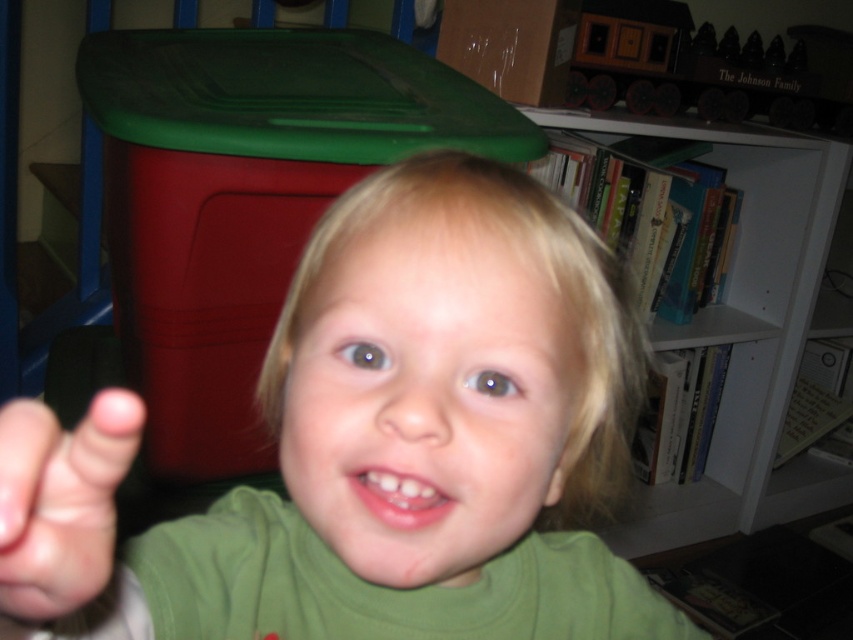
You are a photographer trying to capture a photo of the child and the white matte bookshelf at upper right. The green matte shirt at center is blocking part of the bookshelf. Can you adjust your position to the left or right to get a clear view of both the child and the bookshelf without the shirt blocking it?

The green matte shirt at center is positioned on the left side of the white matte bookshelf at upper right. To avoid blocking, move to the right side so that the shirt moves out of the way, allowing both the child and the bookshelf to be visible.

You are standing in the room where the child is and want to place a new book on the white matte bookshelf at upper right. Based on the scene description, can you determine the exact location coordinates where you should place the new book?

The white matte bookshelf at upper right is located at point (746, 330), so you should place the new book at those coordinates.

The child in the image is wearing a green matte shirt at center and has pink flesh at center. Which of these two items is taller?

The green matte shirt at center is taller than the pink flesh at center.